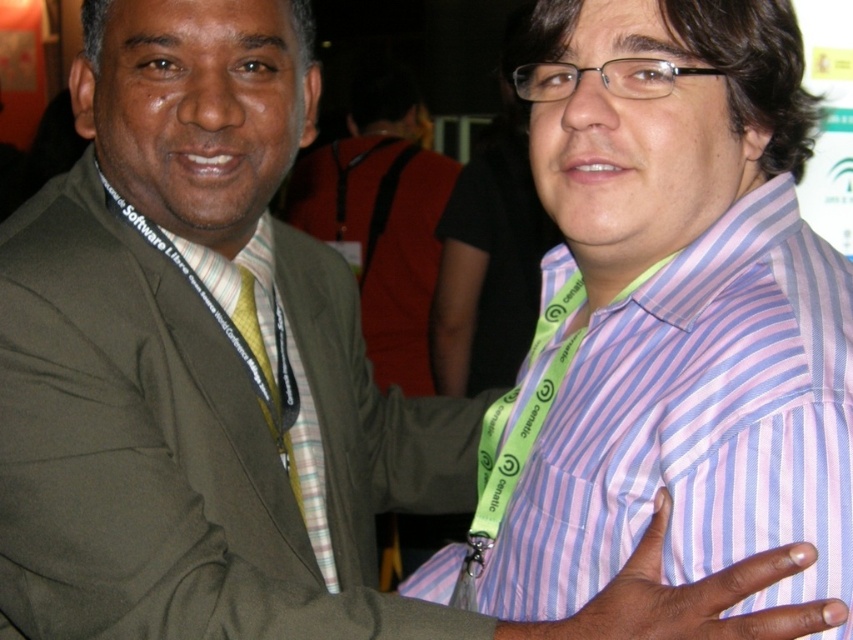
Does point (109, 298) come behind point (720, 449)?

Yes, it is behind point (720, 449).

Which is more to the left, green fabric suit at left or pink striped dress shirt at right?

green fabric suit at left is more to the left.

The image size is (853, 640). I want to click on green fabric suit at left, so click(195, 445).